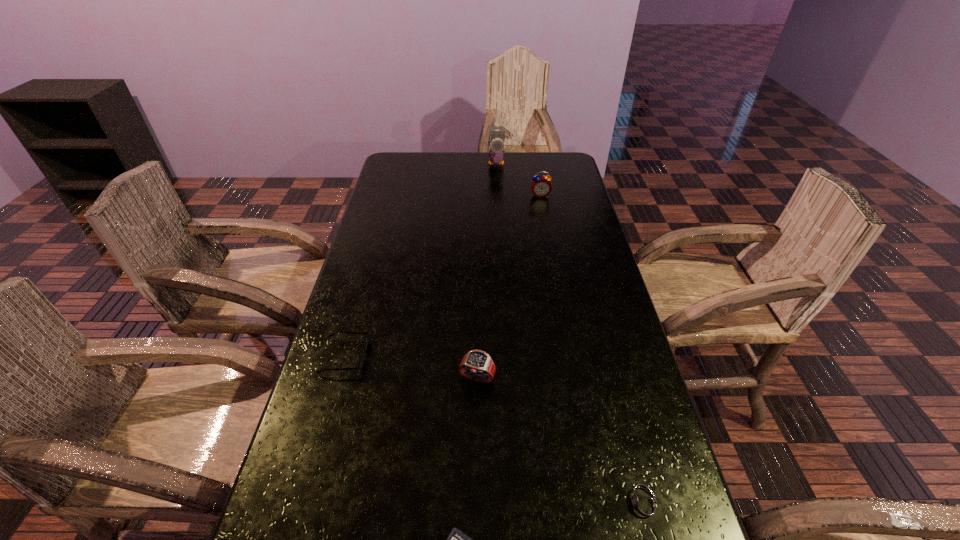
Identify the location of object that is the second closest to the leftmost object. This screenshot has width=960, height=540. (456, 539).

Locate which object is the second closest to the calculator. Please provide its 2D coordinates. Your answer should be formatted as a tuple, i.e. [(x, y)], where the tuple contains the x and y coordinates of a point satisfying the conditions above.

[(477, 365)]

This screenshot has width=960, height=540. Find the location of `vacant position in the image that satisfies the following two spatial constraints: 1. at the beak of the tallest object; 2. on the front-facing side of the fourth tallest object`. vacant position in the image that satisfies the following two spatial constraints: 1. at the beak of the tallest object; 2. on the front-facing side of the fourth tallest object is located at coordinates (507, 356).